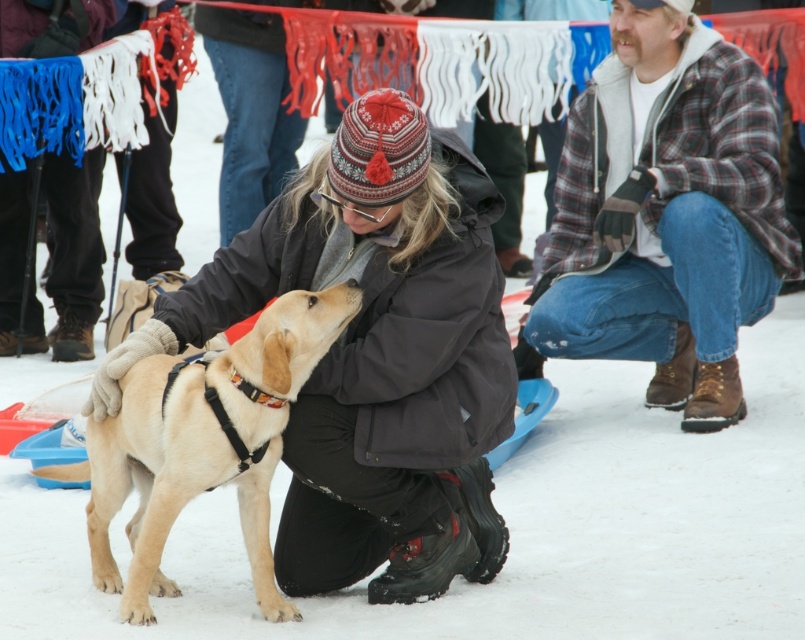
You are a photographer trying to capture a group photo of the matte black jacket at center and the plaid flannel shirt at lower right. Based on their sizes, which one should you position closer to the camera to ensure both appear equally sized in the photo?

The matte black jacket at center is wider than the plaid flannel shirt at lower right. To make them appear equally sized in the photo, position the plaid flannel shirt at lower right closer to the camera since it is narrower.

In the scene shown: You are a photographer trying to capture a photo of the light brown fur at center and the plaid flannel shirt at lower right. Which object should you focus on first if you want to ensure both are in focus without adjusting the camera settings?

The plaid flannel shirt at lower right should be focused on first because it is taller than the light brown fur at center, so focusing on the taller object first ensures both will be in focus.

In the scene shown: You are an observer standing in front of the winter scene. You notice the matte black jacket at center and the light brown fur at center. Which object takes up more space in the image?

The matte black jacket at center is larger in size than the light brown fur at center, so it takes up more space in the image.